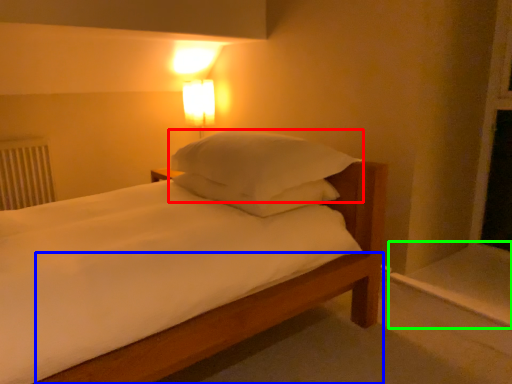
Question: Based on their relative distances, which object is nearer to pillow (highlighted by a red box)? Choose from bed frame (highlighted by a blue box) and window sill (highlighted by a green box).

Choices:
 (A) bed frame
 (B) window sill

Answer: (A)